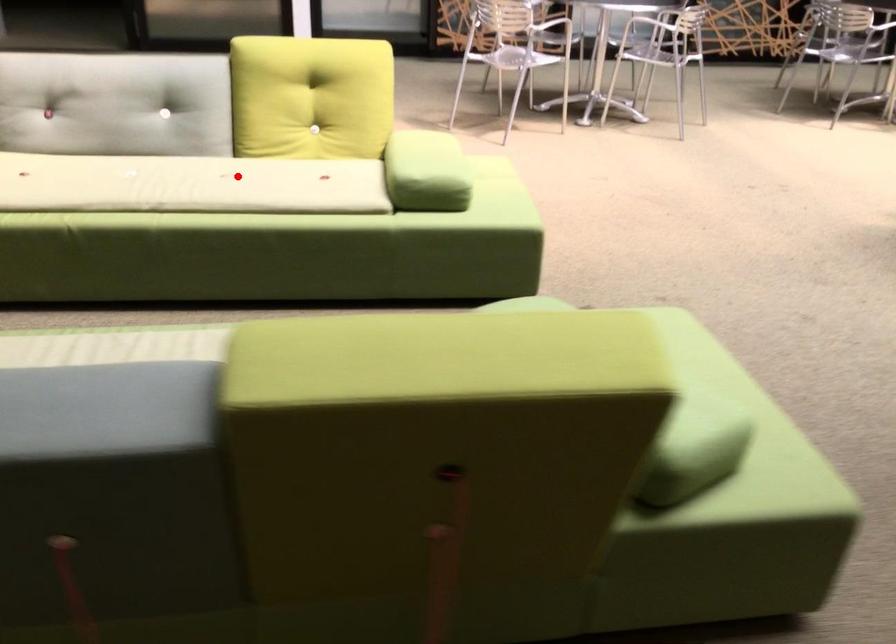
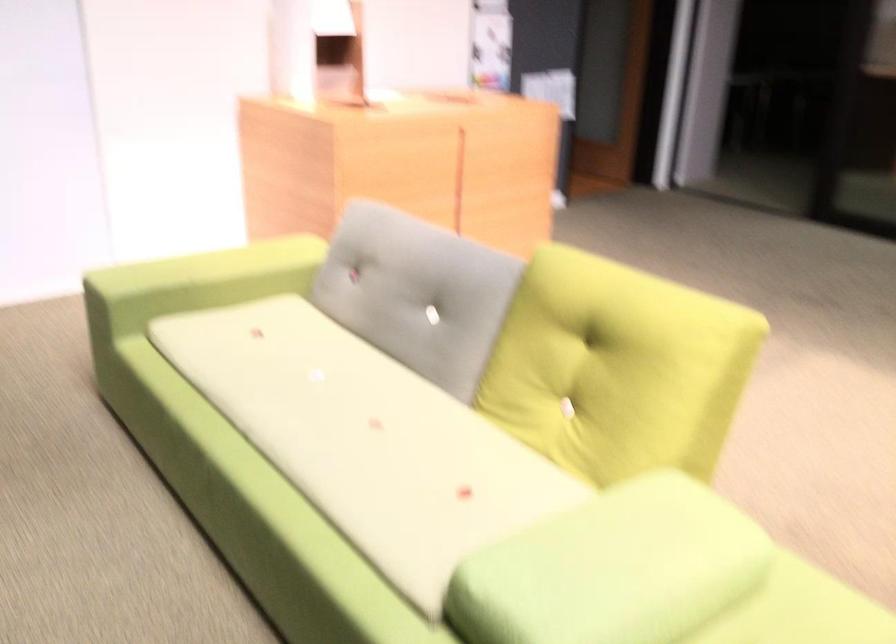
Question: I am providing you with two images of the same scene from different viewpoints. A red point is shown in image1. For the corresponding object point in image2, is it positioned nearer or farther from the camera?

Choices:
 (A) Nearer
 (B) Farther

Answer: (A)